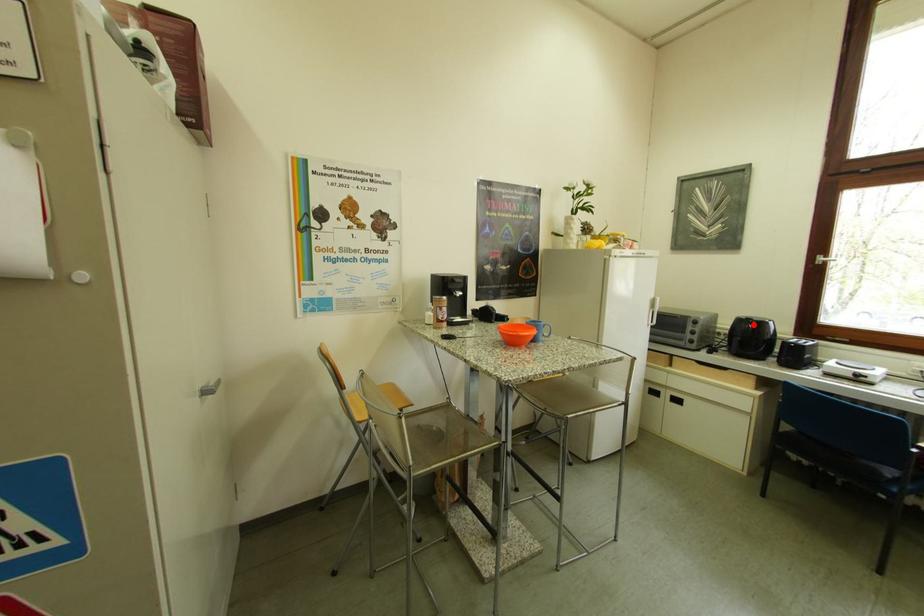
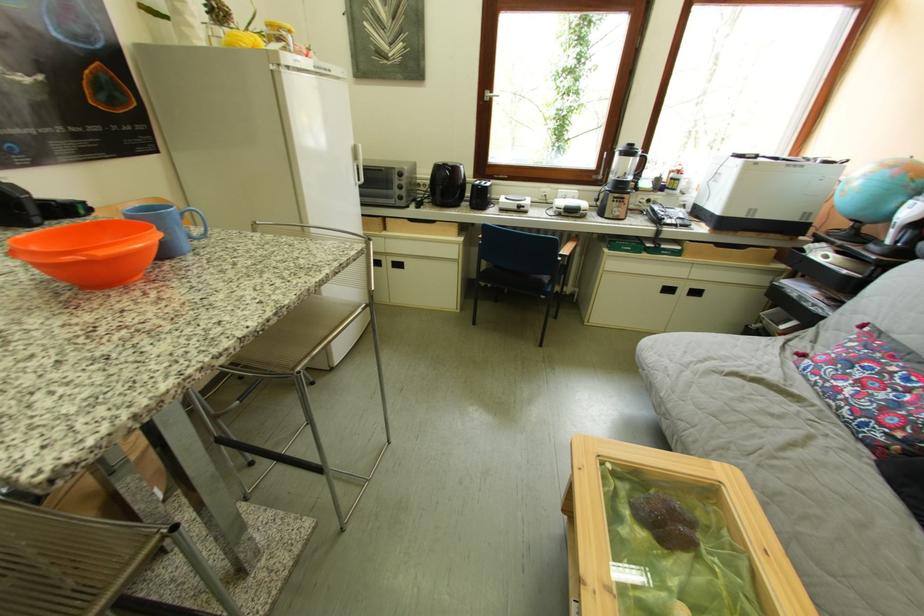
Where in the second image is the point corresponding to the highlighted location from the first image?

(451, 171)